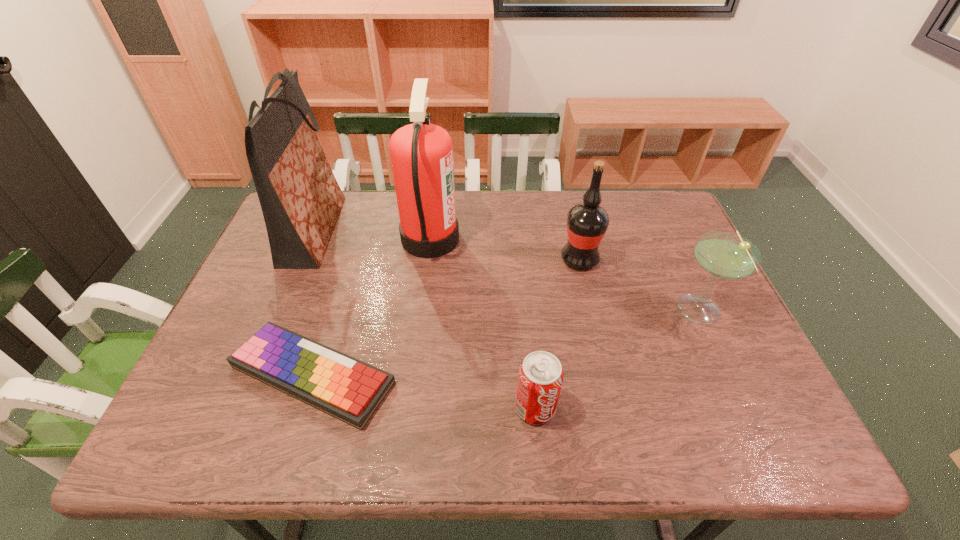
You are a GUI agent. You are given a task and a screenshot of the screen. Output one action in this format:
    pyautogui.click(x=<x>, y=<y>)
    Task: Click on the free space that is in between the shortest object and the third shortest object
    
    Given the screenshot: What is the action you would take?
    pyautogui.click(x=506, y=343)

Where is `object that is the fifth closest to the martini`? This screenshot has width=960, height=540. object that is the fifth closest to the martini is located at coordinates coord(300,198).

Find the location of `object that is the closest to the third tallest object`. object that is the closest to the third tallest object is located at coordinates (725, 255).

This screenshot has width=960, height=540. Identify the location of free location that satisfies the following two spatial constraints: 1. at the nozzle of the fire extinguisher; 2. on the back side of the fourth tallest object. (421, 312).

The image size is (960, 540). Identify the location of free space that satisfies the following two spatial constraints: 1. at the nozzle of the fire extinguisher; 2. on the right side of the martini. (421, 312).

Where is `vacant region that satisfies the following two spatial constraints: 1. at the nozzle of the fire extinguisher; 2. on the left side of the rightmost object`? The width and height of the screenshot is (960, 540). vacant region that satisfies the following two spatial constraints: 1. at the nozzle of the fire extinguisher; 2. on the left side of the rightmost object is located at coordinates (421, 312).

You are a GUI agent. You are given a task and a screenshot of the screen. Output one action in this format:
    pyautogui.click(x=<x>, y=<y>)
    Task: Click on the vacant space that satisfies the following two spatial constraints: 1. on the back side of the soda can; 2. at the nozzle of the fire extinguisher
    
    Given the screenshot: What is the action you would take?
    pyautogui.click(x=519, y=239)

Where is `free space that satisfies the following two spatial constraints: 1. at the nozzle of the fire extinguisher; 2. on the back side of the fourth tallest object`? free space that satisfies the following two spatial constraints: 1. at the nozzle of the fire extinguisher; 2. on the back side of the fourth tallest object is located at coordinates (421, 312).

Where is `vacant position in the image that satisfies the following two spatial constraints: 1. on the back side of the shortest object; 2. on the right side of the third tallest object`? vacant position in the image that satisfies the following two spatial constraints: 1. on the back side of the shortest object; 2. on the right side of the third tallest object is located at coordinates (348, 259).

I want to click on free point that satisfies the following two spatial constraints: 1. on the back side of the fourth tallest object; 2. on the right side of the soda can, so click(526, 312).